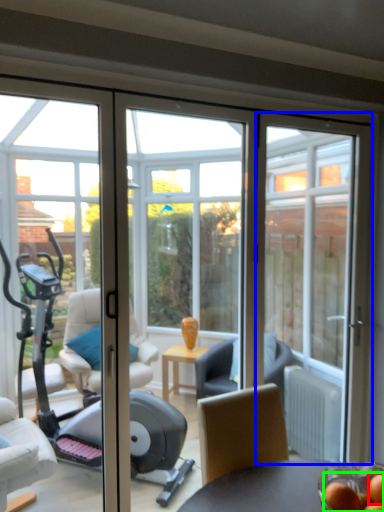
Question: Based on their relative distances, which object is nearer to food (highlighted by a red box)? Choose from door (highlighted by a blue box) and food (highlighted by a green box).

Choices:
 (A) door
 (B) food

Answer: (B)